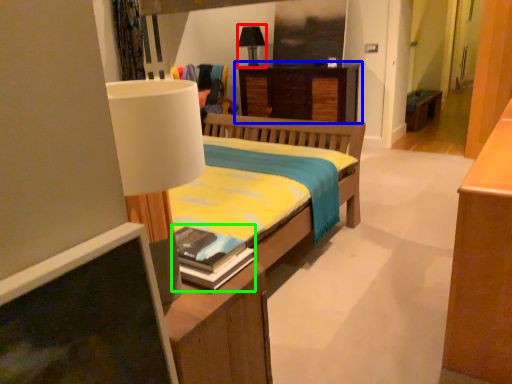
Question: Considering the real-world distances, which object is closest to table lamp (highlighted by a red box)? desk (highlighted by a blue box) or book (highlighted by a green box).

Choices:
 (A) desk
 (B) book

Answer: (A)